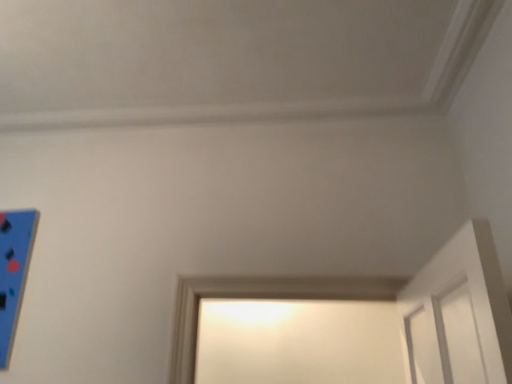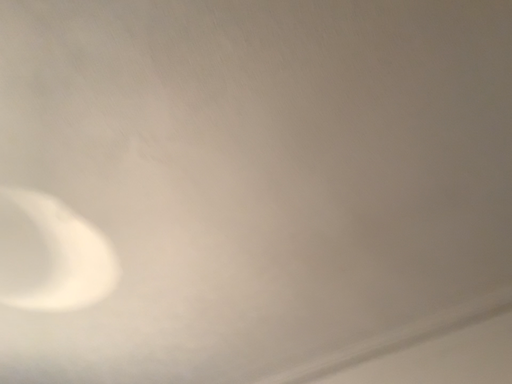
Question: Which way did the camera rotate in the video?

Choices:
 (A) rotated left
 (B) rotated right

Answer: (A)